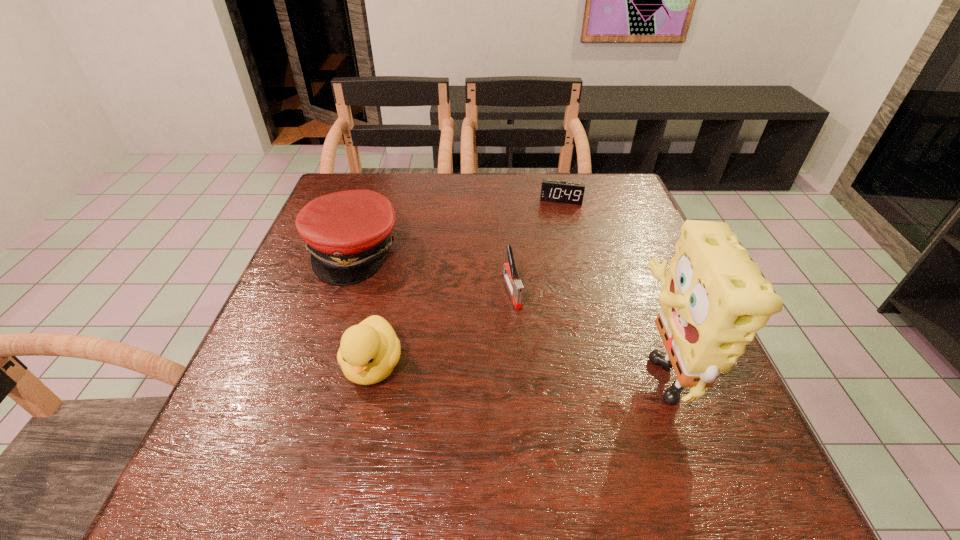
Find the location of a particular element. The image size is (960, 540). duck that is at the near edge is located at coordinates (369, 351).

Locate an element on the screen. sponge that is at the near edge is located at coordinates (713, 300).

Identify the location of object that is at the left edge. (347, 233).

Locate an element on the screen. The height and width of the screenshot is (540, 960). sponge at the right edge is located at coordinates click(713, 300).

I want to click on alarm clock present at the right edge, so click(557, 191).

Find the location of a particular element. The height and width of the screenshot is (540, 960). object present at the far right corner is located at coordinates (557, 191).

This screenshot has width=960, height=540. I want to click on object that is at the near right corner, so click(713, 300).

In the image, there is a desktop. Where is `free space at the far edge`? free space at the far edge is located at coordinates (545, 203).

Locate an element on the screen. This screenshot has width=960, height=540. free region at the near edge of the desktop is located at coordinates (528, 423).

Locate an element on the screen. vacant region at the left edge of the desktop is located at coordinates (315, 301).